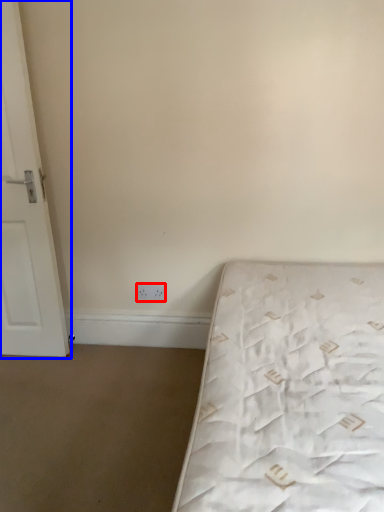
Question: Which of the following is the closest to the observer, electric outlet (highlighted by a red box) or door (highlighted by a blue box)?

Choices:
 (A) electric outlet
 (B) door

Answer: (B)